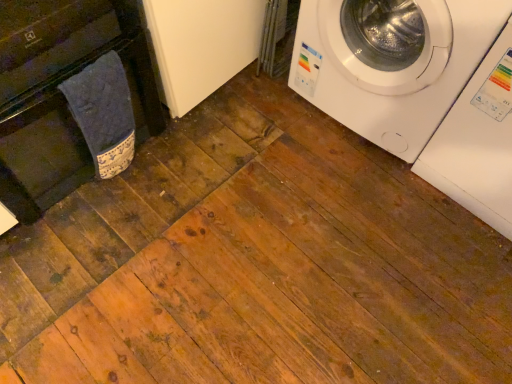
Locate an element on the screen. This screenshot has width=512, height=384. unoccupied area in front of blue fabric towel at left is located at coordinates (111, 207).